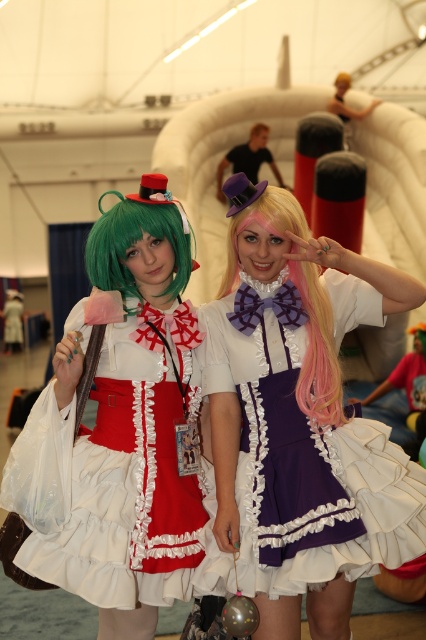
Question: Which point is closer to the camera taking this photo?

Choices:
 (A) (138, 234)
 (B) (408, 556)
 (C) (51, 561)
 (D) (322, 417)

Answer: (C)

Question: Is purple satin dress at center further to the viewer compared to matte white dress at center?

Choices:
 (A) no
 (B) yes

Answer: (A)

Question: Based on their relative distances, which object is nearer to the matte white dress at center?

Choices:
 (A) green matte wig at left
 (B) purple satin dress at center

Answer: (B)

Question: Does matte white dress at center appear over green matte wig at left?

Choices:
 (A) yes
 (B) no

Answer: (B)

Question: Among these points, which one is nearest to the camera?

Choices:
 (A) (112, 189)
 (B) (304, 216)
 (C) (307, 241)

Answer: (A)

Question: Is purple satin dress at center wider than green matte wig at left?

Choices:
 (A) no
 (B) yes

Answer: (B)